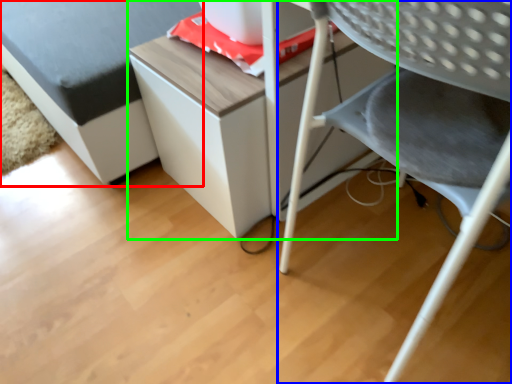
Question: Based on their relative distances, which object is nearer to furniture (highlighted by a red box)? Choose from chair (highlighted by a blue box) and table (highlighted by a green box).

Choices:
 (A) chair
 (B) table

Answer: (B)